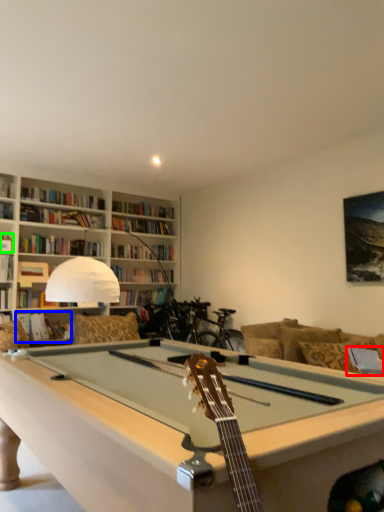
Question: Based on their relative distances, which object is farther from pillow (highlighted by a red box)? Choose from book (highlighted by a blue box) and book (highlighted by a green box).

Choices:
 (A) book
 (B) book

Answer: (B)